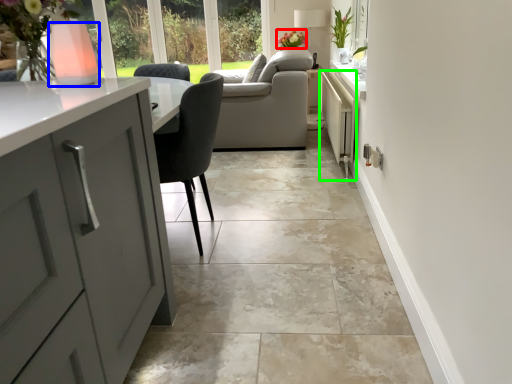
Question: Which object is the closest to the flower (highlighted by a red box)? Choose among these: vase (highlighted by a blue box) or appliance (highlighted by a green box).

Choices:
 (A) vase
 (B) appliance

Answer: (B)